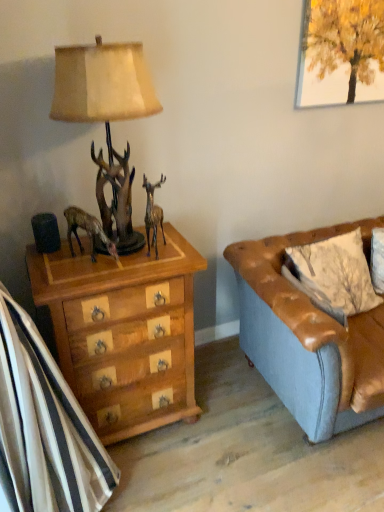
At what (x,y) coordinates should I click in order to perform the action: click on vacant space to the right of wooden chest of drawers at left. Please return your answer as a coordinate pair (x, y). The image size is (384, 512). Looking at the image, I should click on 221,421.